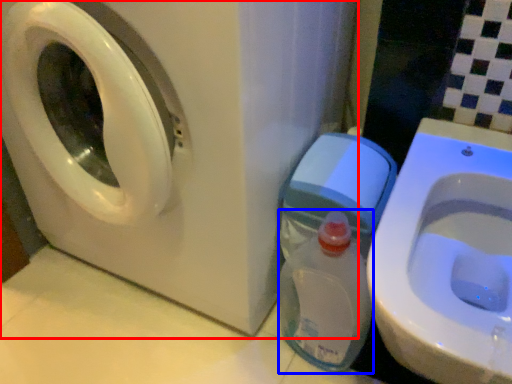
Question: Which object is closer to the camera taking this photo, washing machine (highlighted by a red box) or baby bottle (highlighted by a blue box)?

Choices:
 (A) washing machine
 (B) baby bottle

Answer: (A)